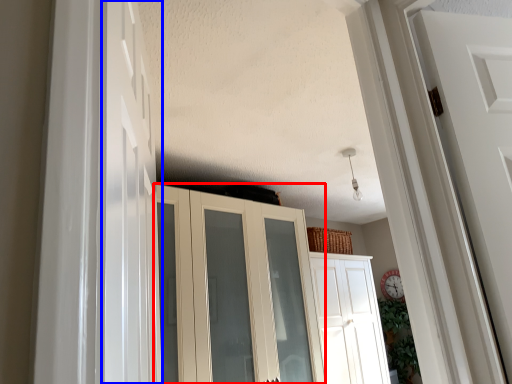
Question: Which point is further to the camera, cupboard (highlighted by a red box) or door (highlighted by a blue box)?

Choices:
 (A) cupboard
 (B) door

Answer: (A)